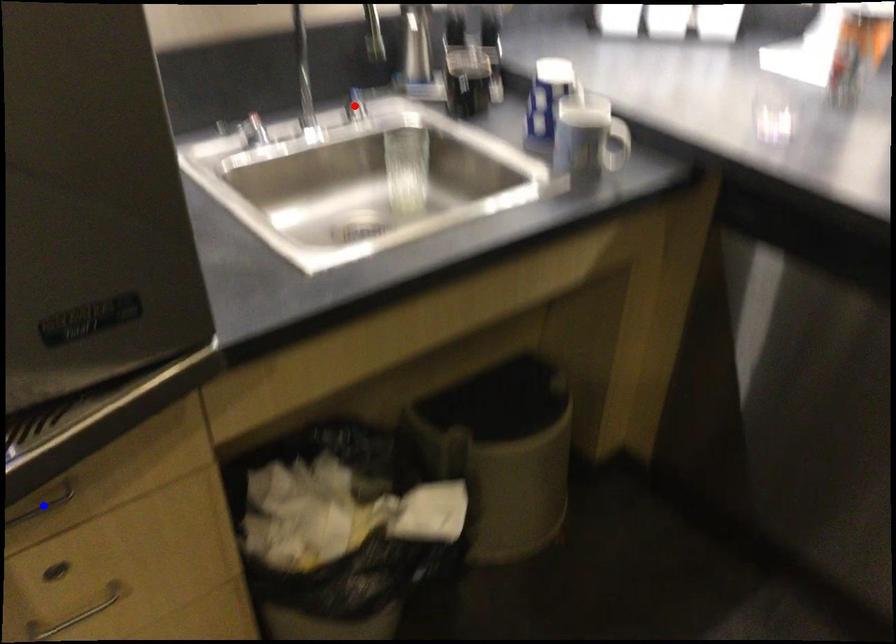
Question: Two points are marked on the image. Which point is closer to the camera?

Choices:
 (A) Blue point is closer.
 (B) Red point is closer.

Answer: (A)